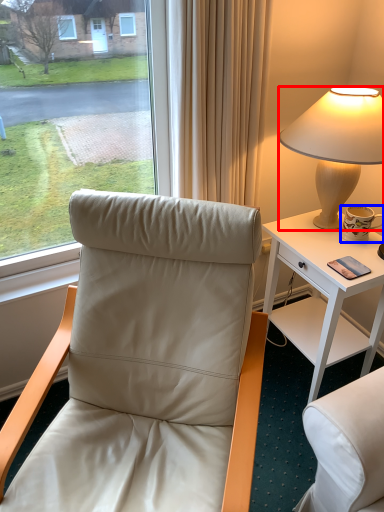
Question: Among these objects, which one is farthest to the camera, lamp (highlighted by a red box) or coffee cup (highlighted by a blue box)?

Choices:
 (A) lamp
 (B) coffee cup

Answer: (B)